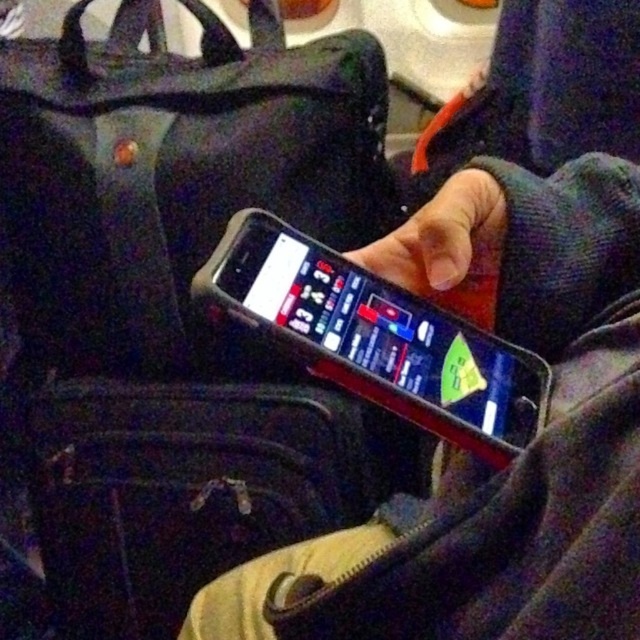
Question: Is black matte phone at center thinner than black fabric suitcase at center?

Choices:
 (A) yes
 (B) no

Answer: (A)

Question: Can you confirm if black matte phone at center is positioned to the right of black fabric suitcase at center?

Choices:
 (A) no
 (B) yes

Answer: (B)

Question: Can you confirm if black fabric bag at center is positioned to the right of black rubberized smartphone at center?

Choices:
 (A) no
 (B) yes

Answer: (A)

Question: Which is nearer to the black rubberized smartphone at center?

Choices:
 (A) black fabric suitcase at center
 (B) black fabric bag at center

Answer: (B)

Question: Among these points, which one is farthest from the camera?

Choices:
 (A) pyautogui.click(x=228, y=300)
 (B) pyautogui.click(x=172, y=316)
 (C) pyautogui.click(x=458, y=508)

Answer: (B)

Question: Which object is farther from the camera taking this photo?

Choices:
 (A) black fabric bag at center
 (B) black matte phone at center
 (C) black fabric suitcase at center

Answer: (C)